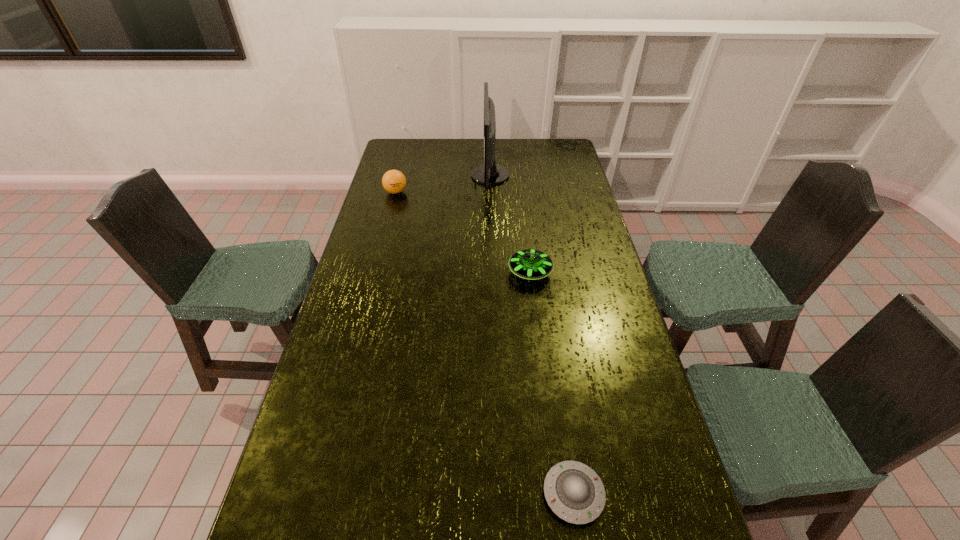
You are a GUI agent. You are given a task and a screenshot of the screen. Output one action in this format:
    pyautogui.click(x=<x>, y=<y>)
    Task: Click on the vacant region that satisfies the following two spatial constraints: 1. on the screen side of the third farthest object; 2. on the left side of the tallest object
    This screenshot has width=960, height=540.
    Given the screenshot: What is the action you would take?
    pyautogui.click(x=493, y=273)

Where is `blank area in the image that satisfies the following two spatial constraints: 1. on the side with brand of the ping-pong ball; 2. on the left side of the shorter saucer`? blank area in the image that satisfies the following two spatial constraints: 1. on the side with brand of the ping-pong ball; 2. on the left side of the shorter saucer is located at coordinates (318, 494).

Where is `vacant area that satisfies the following two spatial constraints: 1. on the side with brand of the farther saucer; 2. on the left side of the ping-pong ball`? The image size is (960, 540). vacant area that satisfies the following two spatial constraints: 1. on the side with brand of the farther saucer; 2. on the left side of the ping-pong ball is located at coordinates (374, 273).

The height and width of the screenshot is (540, 960). Find the location of `free space that satisfies the following two spatial constraints: 1. on the screen side of the second nearest object; 2. on the right side of the monitor`. free space that satisfies the following two spatial constraints: 1. on the screen side of the second nearest object; 2. on the right side of the monitor is located at coordinates pos(493,273).

Locate an element on the screen. This screenshot has height=540, width=960. vacant space that satisfies the following two spatial constraints: 1. on the front side of the second shortest object; 2. on the left side of the shorter saucer is located at coordinates (558, 494).